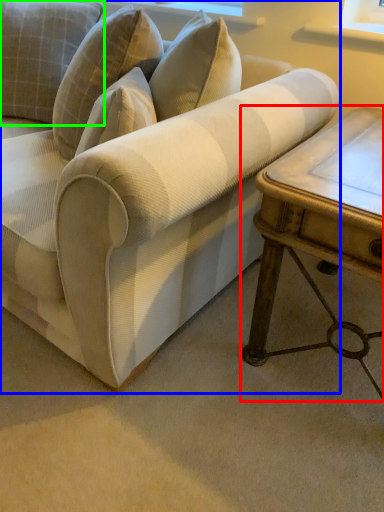
Question: Considering the real-world distances, which object is closest to table (highlighted by a red box)? studio couch (highlighted by a blue box) or pillow (highlighted by a green box).

Choices:
 (A) studio couch
 (B) pillow

Answer: (A)